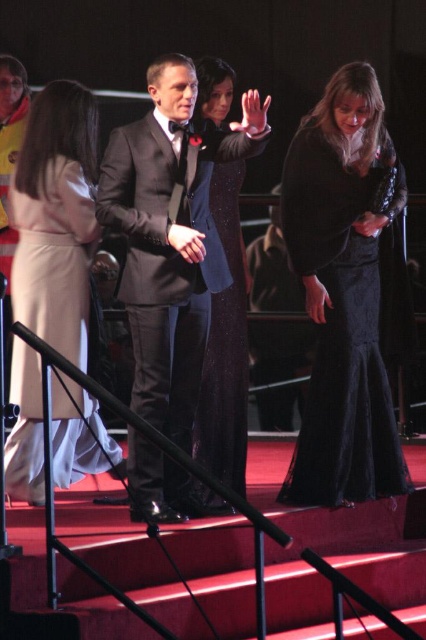
Question: Which of the following is the closest to the observer?

Choices:
 (A) dark brown leather jacket at center
 (B) velvet black dress at lower right
 (C) beige wool coat at center

Answer: (C)

Question: In this image, where is velvet black dress at lower right located relative to shiny black suit at center?

Choices:
 (A) above
 (B) below

Answer: (A)

Question: Based on their relative distances, which object is nearer to the dark brown leather jacket at center?

Choices:
 (A) velvet black dress at lower right
 (B) beige wool coat at center

Answer: (A)

Question: Does velvet black dress at lower right come behind dark brown leather jacket at center?

Choices:
 (A) yes
 (B) no

Answer: (B)

Question: Estimate the real-world distances between objects in this image. Which object is closer to the shiny black suit at center?

Choices:
 (A) dark brown leather jacket at center
 (B) sparkly black dress at center
 (C) velvet black dress at lower right

Answer: (B)

Question: Can you confirm if beige wool coat at center is smaller than sparkly black dress at center?

Choices:
 (A) yes
 (B) no

Answer: (A)